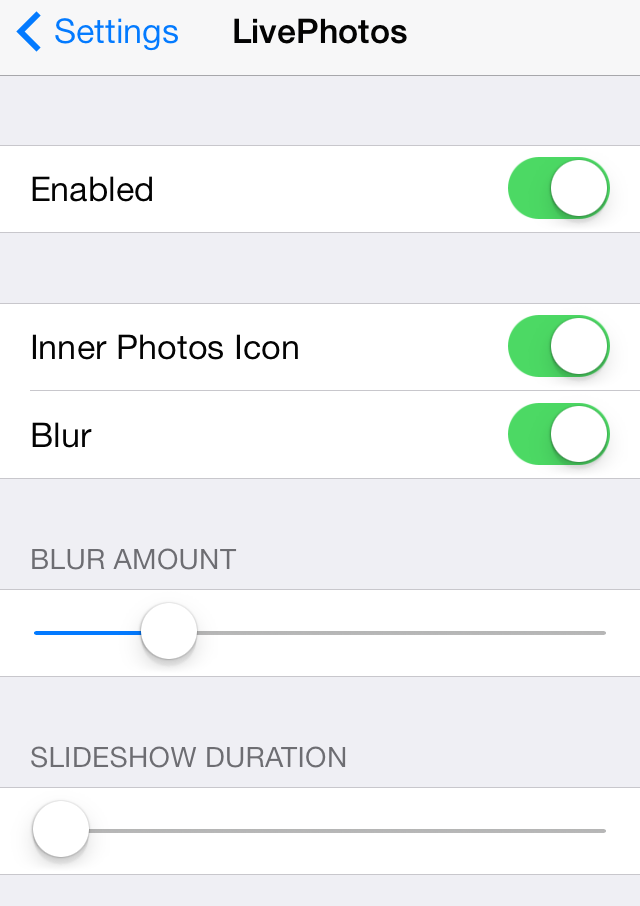
In order to click on on off button in this screenshot , I will do `click(568, 197)`, `click(577, 352)`, `click(577, 432)`.